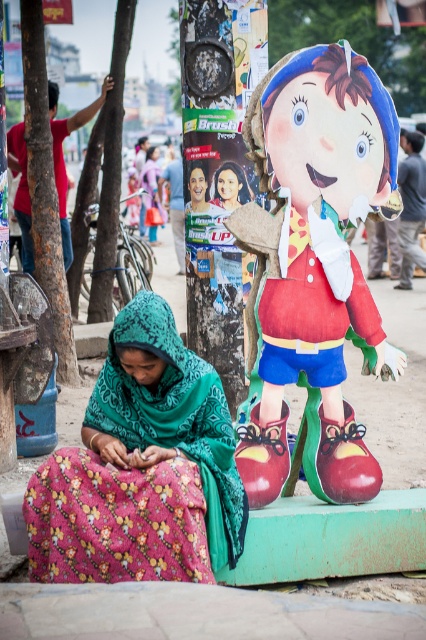
Question: Considering the real-world distances, which object is closest to the matte plastic portrait at center?

Choices:
 (A) cardboard doll at center
 (B) floral fabric scarf at lower left

Answer: (A)

Question: Does cardboard doll at center appear under matte plastic portrait at center?

Choices:
 (A) yes
 (B) no

Answer: (A)

Question: Does cardboard doll at center come in front of floral fabric scarf at lower left?

Choices:
 (A) yes
 (B) no

Answer: (B)

Question: Which of these objects is positioned farthest from the floral fabric scarf at lower left?

Choices:
 (A) matte plastic portrait at center
 (B) cardboard doll at center

Answer: (A)

Question: Estimate the real-world distances between objects in this image. Which object is farther from the floral fabric scarf at lower left?

Choices:
 (A) matte plastic portrait at center
 (B) cardboard doll at center

Answer: (A)

Question: Does cardboard doll at center appear over matte plastic portrait at center?

Choices:
 (A) yes
 (B) no

Answer: (B)